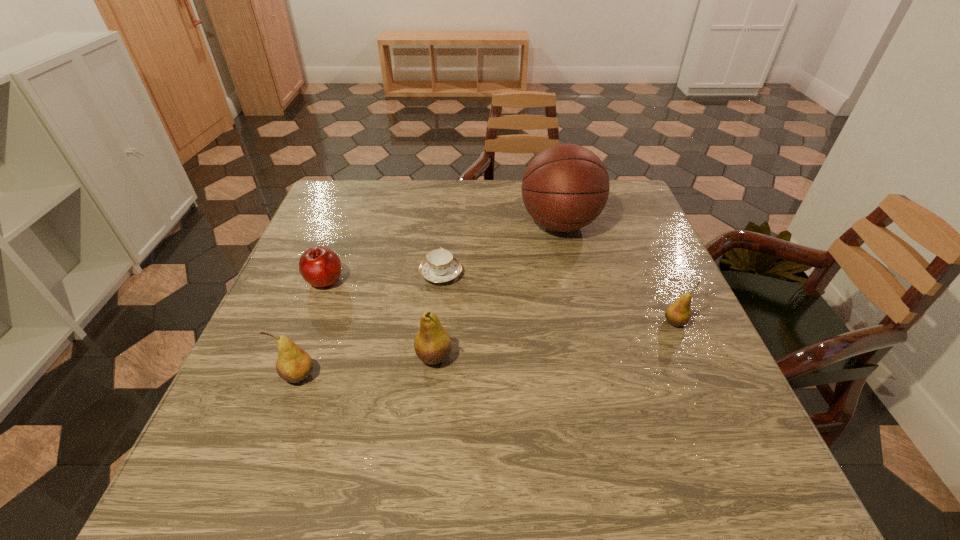
Locate an element on the screen. the leftmost pear is located at coordinates click(x=293, y=364).

The width and height of the screenshot is (960, 540). What are the coordinates of `the third tallest object` in the screenshot? It's located at (293, 364).

This screenshot has width=960, height=540. I want to click on the second pear from left to right, so click(432, 344).

I want to click on the tallest pear, so click(432, 344).

Image resolution: width=960 pixels, height=540 pixels. I want to click on the rightmost object, so click(x=678, y=313).

Find the location of a particular element. The width and height of the screenshot is (960, 540). the third nearest object is located at coordinates (678, 313).

At what (x,y) coordinates should I click in order to perform the action: click on apple. Please return your answer as a coordinate pair (x, y). Looking at the image, I should click on (321, 267).

The height and width of the screenshot is (540, 960). I want to click on the fifth object from left to right, so click(565, 187).

The image size is (960, 540). In order to click on basketball in this screenshot , I will do click(x=565, y=187).

Where is `teacup`? Image resolution: width=960 pixels, height=540 pixels. teacup is located at coordinates (440, 266).